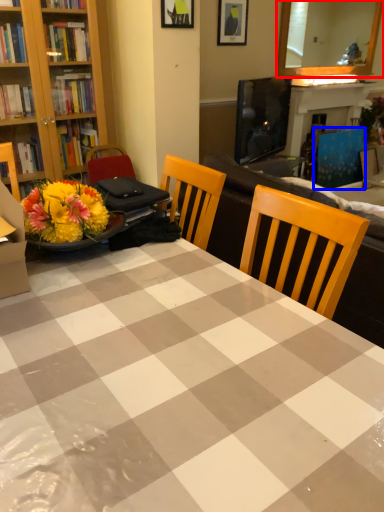
Question: Which object is closer to the camera taking this photo, mirror (highlighted by a red box) or armchair (highlighted by a blue box)?

Choices:
 (A) mirror
 (B) armchair

Answer: (A)